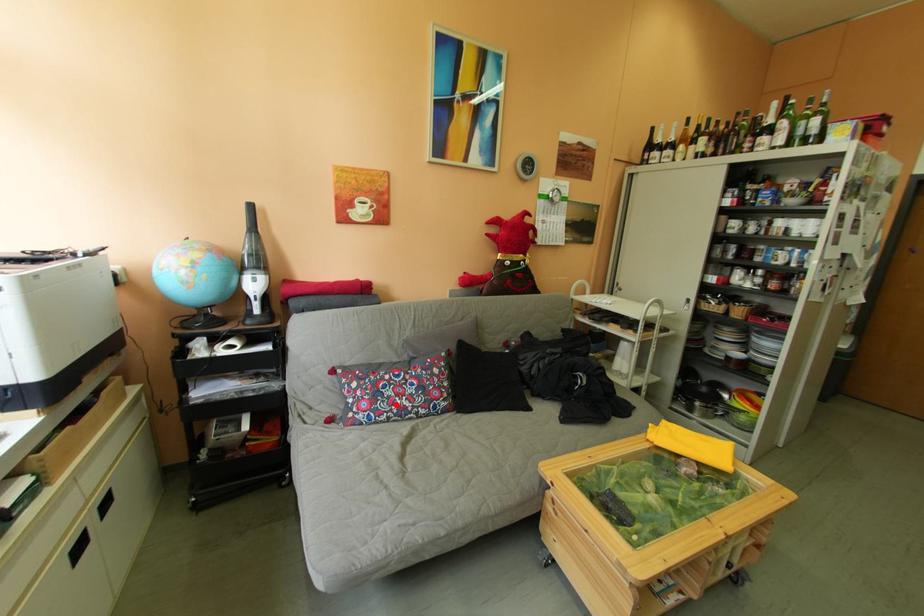
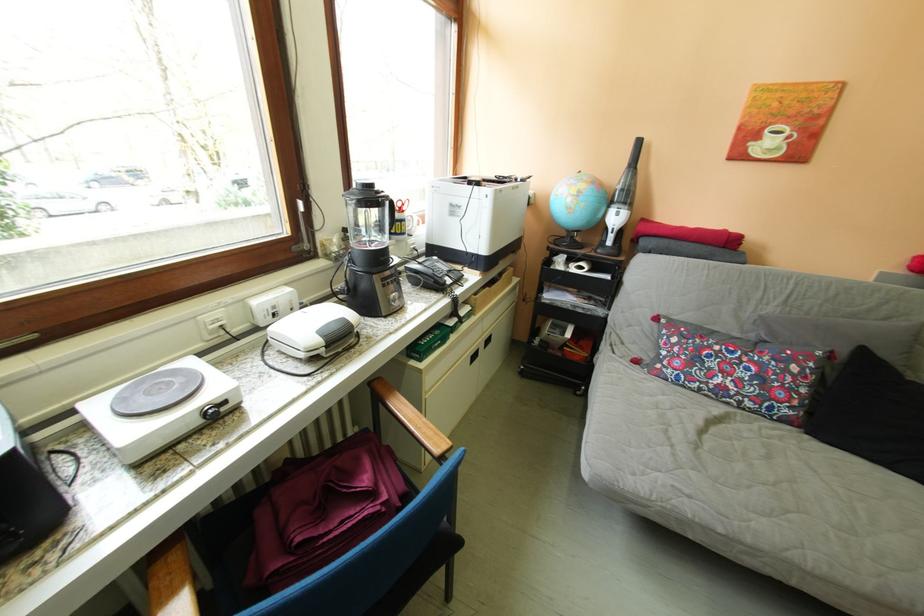
Find the pixel in the second image that matches the highlighted location in the first image.

(714, 373)